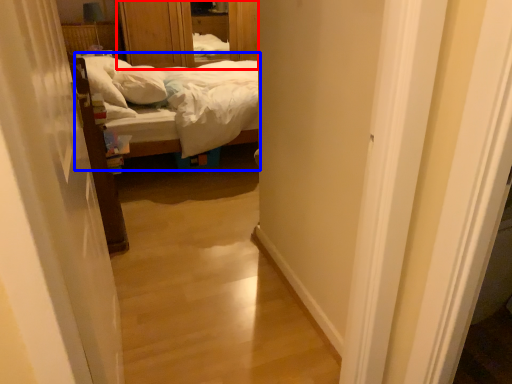
Question: Which of the following is the closest to the observer, dresser (highlighted by a red box) or bed (highlighted by a blue box)?

Choices:
 (A) dresser
 (B) bed

Answer: (B)